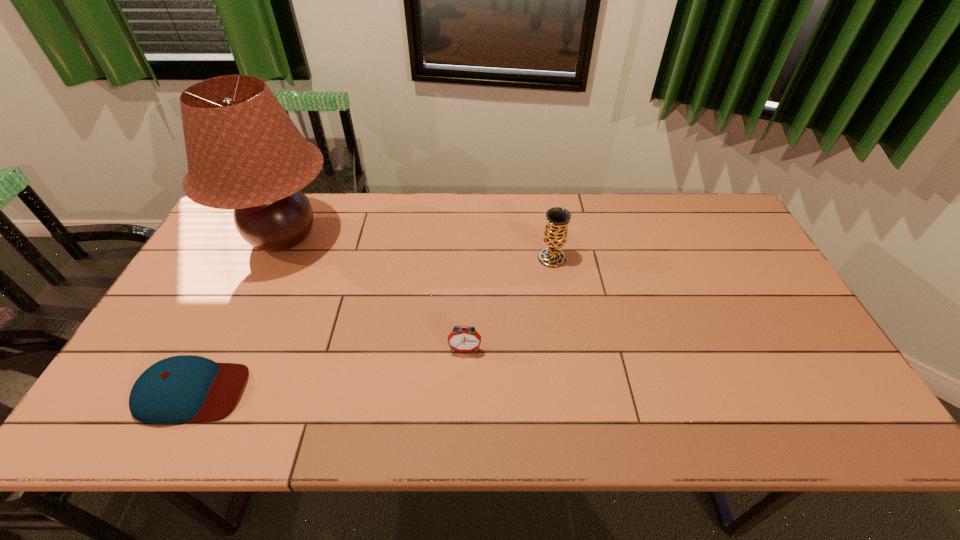
Locate an element on the screen. This screenshot has height=540, width=960. free location that satisfies the following two spatial constraints: 1. on the front-facing side of the tallest object; 2. with the bill of the baseball cap facing forward is located at coordinates (212, 392).